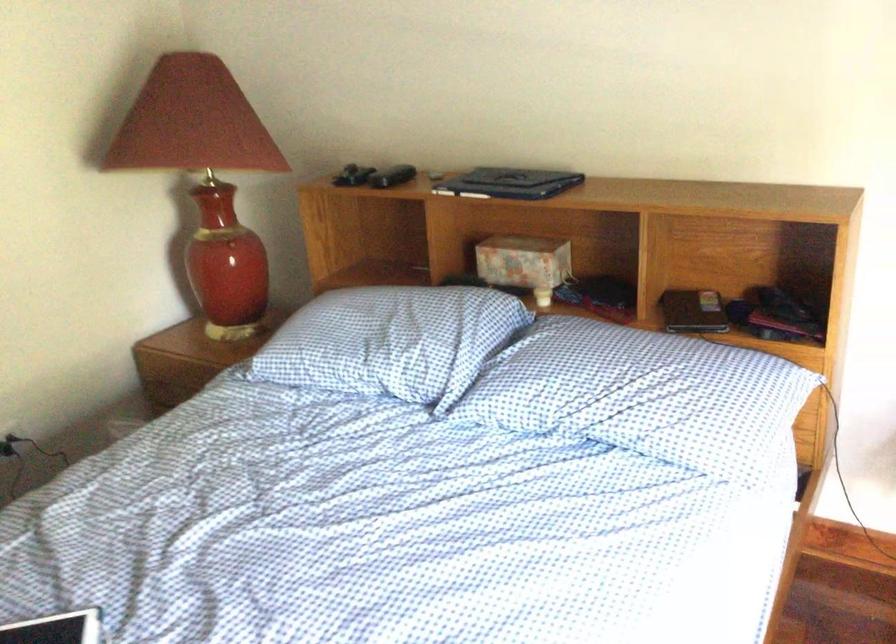
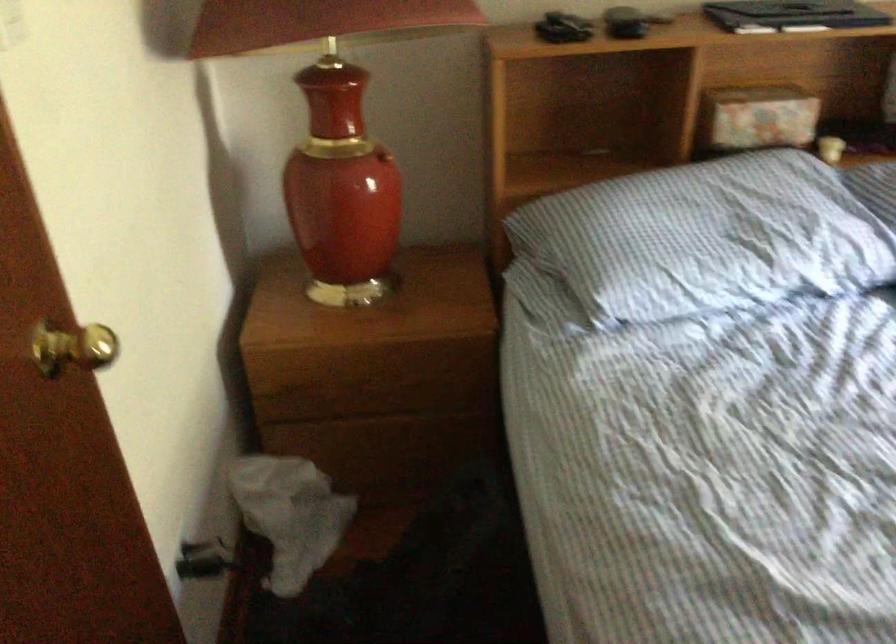
In the second image, find the point that corresponds to the point at 347,333 in the first image.

(707, 238)